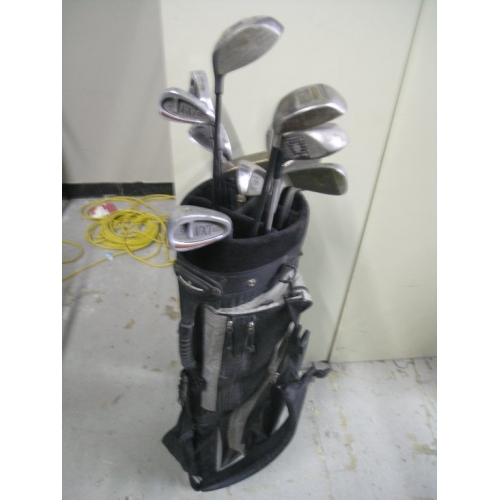
Where is `irons`? This screenshot has width=500, height=500. irons is located at coordinates (253, 182), (201, 236), (317, 183), (225, 138), (191, 116).